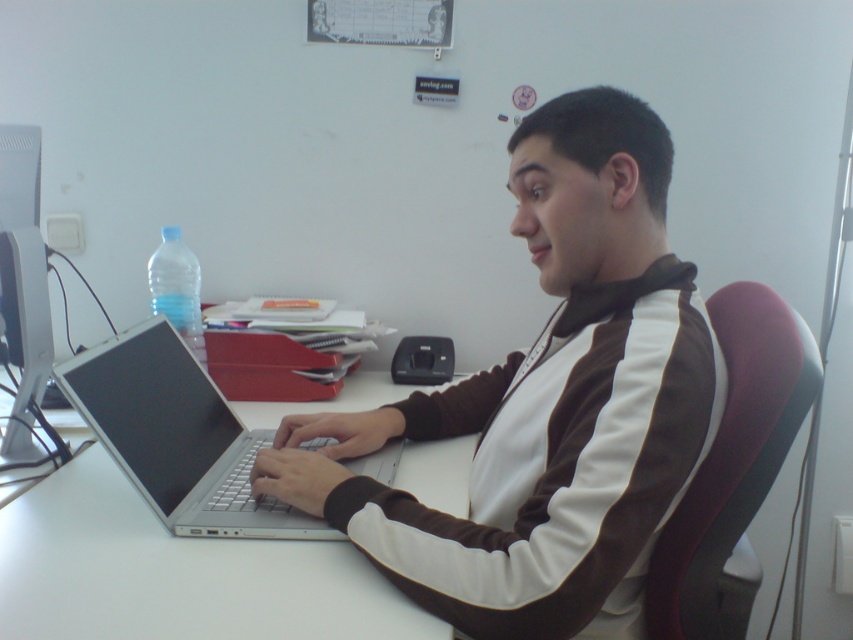
Who is more forward, (259,554) or (142,467)?

Point (259,554)

Identify the location of white glossy table at center. This screenshot has width=853, height=640. (177, 573).

Identify the location of white glossy table at center. Image resolution: width=853 pixels, height=640 pixels. (177, 573).

Is white smooth jacket at center wider than silver metallic laptop at center?

Yes, white smooth jacket at center is wider than silver metallic laptop at center.

Who is more distant from viewer, (283, 493) or (233, 467)?

Point (233, 467)

Does point (526, 586) come farther from viewer compared to point (184, 397)?

No, it is not.

Locate an element on the screen. This screenshot has width=853, height=640. white smooth jacket at center is located at coordinates (546, 404).

In the scene shown: Measure the distance between point (532, 385) and camera.

Point (532, 385) and camera are 1.01 meters apart.

Is point (656, 490) less distant than point (175, 285)?

Yes, it is in front of point (175, 285).

Is point (367, 518) less distant than point (155, 252)?

Yes.

Find the location of `white smooth jacket at center`. white smooth jacket at center is located at coordinates (546, 404).